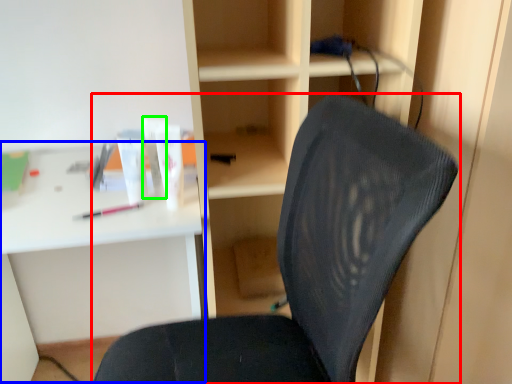
Question: Estimate the real-world distances between objects in this image. Which object is closer to chair (highlighted by a red box), computer desk (highlighted by a blue box) or toiletry (highlighted by a green box)?

Choices:
 (A) computer desk
 (B) toiletry

Answer: (B)